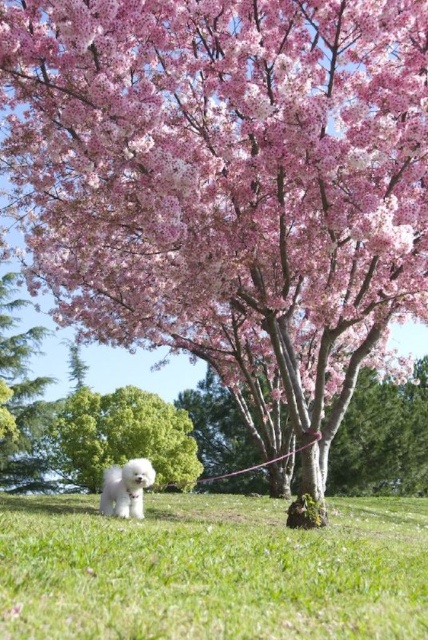
Question: Which object is closer to the camera taking this photo?

Choices:
 (A) white fluffy dog at lower left
 (B) green grass at lower center
 (C) green textured pine tree at left
 (D) pink matte tree at center

Answer: (B)

Question: Which of the following is the closest to the observer?

Choices:
 (A) pink matte tree at center
 (B) green textured pine tree at left
 (C) white fluffy dog at lower left
 (D) green grass at lower center

Answer: (D)

Question: Is green leafy tree at center to the left of pink matte tree at center from the viewer's perspective?

Choices:
 (A) yes
 (B) no

Answer: (B)

Question: Is green leafy tree at center thinner than pink matte tree at center?

Choices:
 (A) no
 (B) yes

Answer: (B)

Question: Which object is positioned farthest from the green leafy tree at center?

Choices:
 (A) green grass at lower center
 (B) green textured pine tree at left
 (C) white fluffy dog at lower left

Answer: (C)

Question: Is green grass at lower center thinner than pink matte tree at center?

Choices:
 (A) yes
 (B) no

Answer: (A)